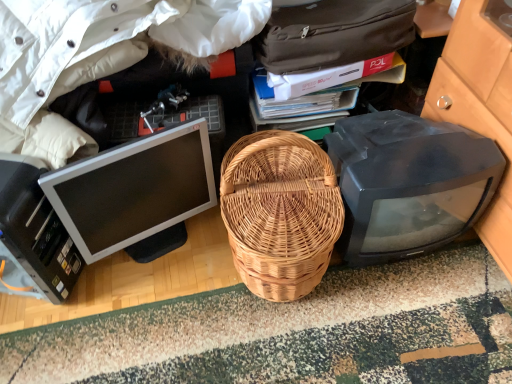
This screenshot has height=384, width=512. I want to click on unoccupied region to the right of natural wicker picnic basket at center, so click(x=412, y=303).